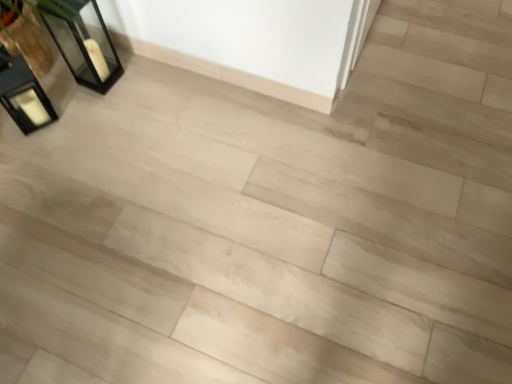
Where is `vacant area that is situated to the right of matte black lantern at left`? This screenshot has width=512, height=384. vacant area that is situated to the right of matte black lantern at left is located at coordinates (87, 118).